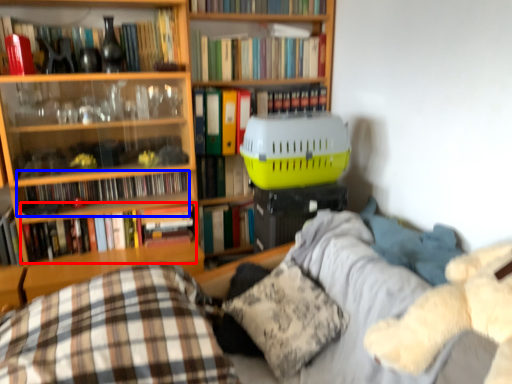
Question: Which of the following is the farthest to the observer, book (highlighted by a red box) or book (highlighted by a blue box)?

Choices:
 (A) book
 (B) book

Answer: (B)